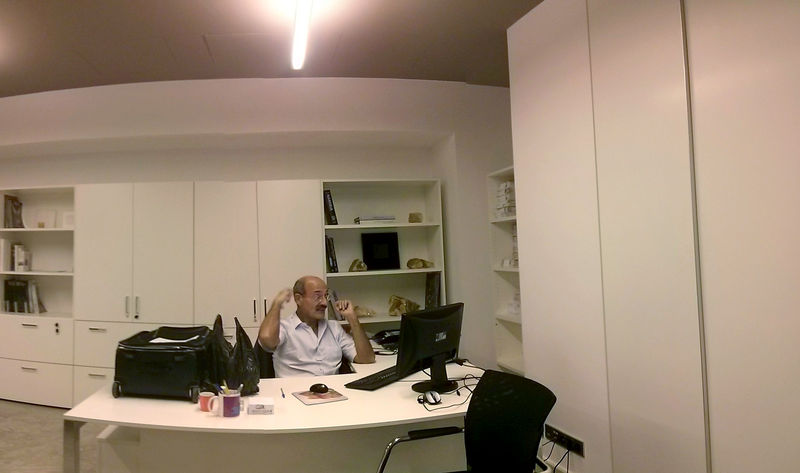
Find the location of a particular element. The width and height of the screenshot is (800, 473). shelves is located at coordinates (373, 235).